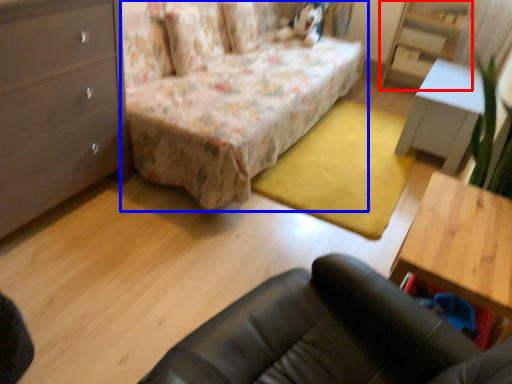
Question: Which point is further to the camera, dresser (highlighted by a red box) or bed (highlighted by a blue box)?

Choices:
 (A) dresser
 (B) bed

Answer: (A)